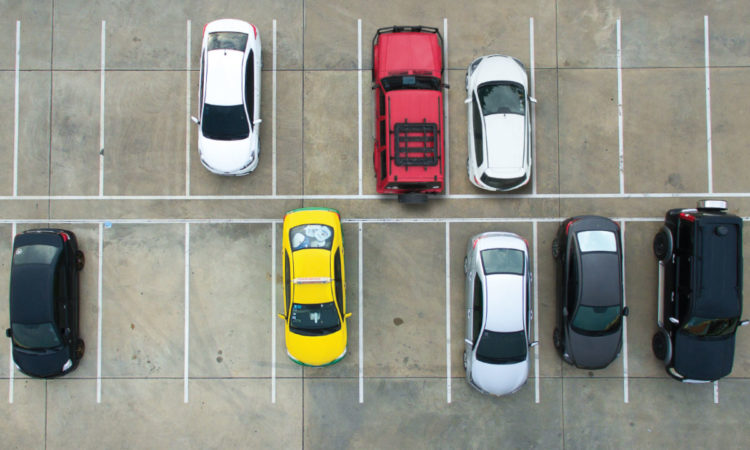
Find the location of a particular element. The width and height of the screenshot is (750, 450). door handles is located at coordinates (672, 296), (672, 258), (466, 314), (469, 278), (530, 314), (528, 274).